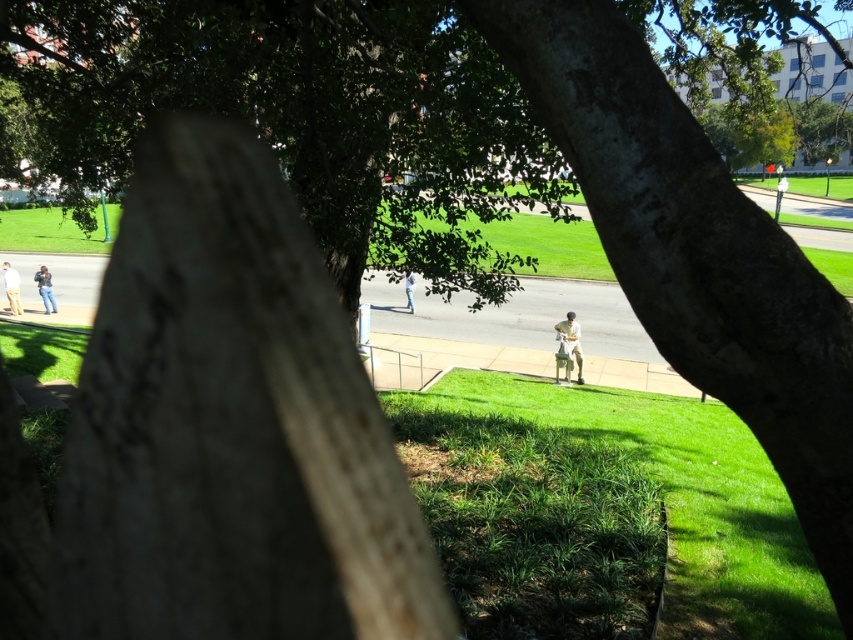
Question: Can you confirm if khaki cotton pants at center is positioned below light blue jeans at left?

Choices:
 (A) no
 (B) yes

Answer: (B)

Question: Estimate the real-world distances between objects in this image. Which object is closer to the light blue shirt at center?

Choices:
 (A) denim pants at left
 (B) light blue jeans at left
 (C) khaki cotton pants at center

Answer: (C)

Question: Is khaki cotton pants at center bigger than light blue shirt at center?

Choices:
 (A) no
 (B) yes

Answer: (A)

Question: Among these points, which one is nearest to the camera?

Choices:
 (A) (12, 300)
 (B) (39, 292)
 (C) (407, 285)

Answer: (A)

Question: Which point is closer to the camera taking this photo?

Choices:
 (A) coord(9,301)
 (B) coord(45,304)
 (C) coord(578,352)
 (D) coord(408,296)

Answer: (C)

Question: Is khaki cotton pants at center wider than light blue shirt at center?

Choices:
 (A) yes
 (B) no

Answer: (B)